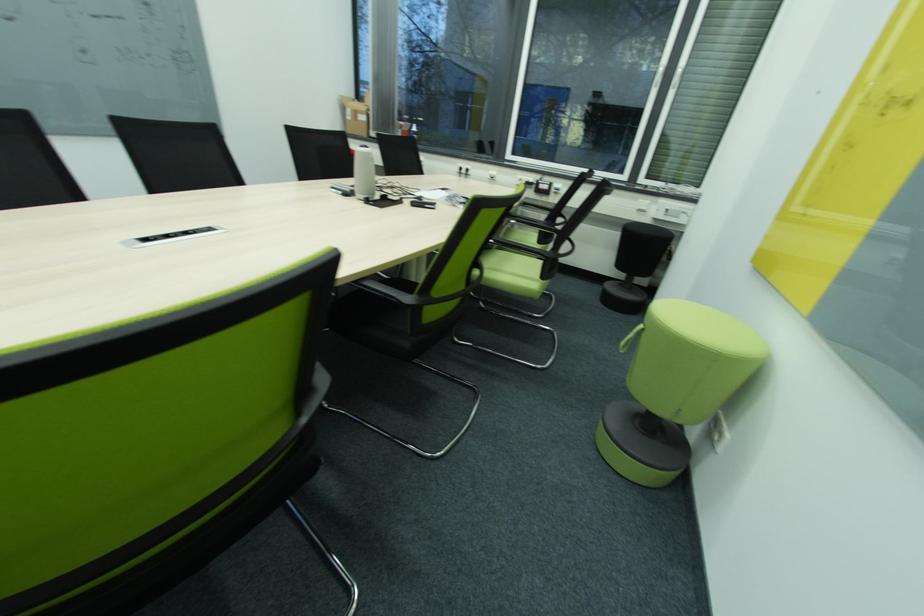
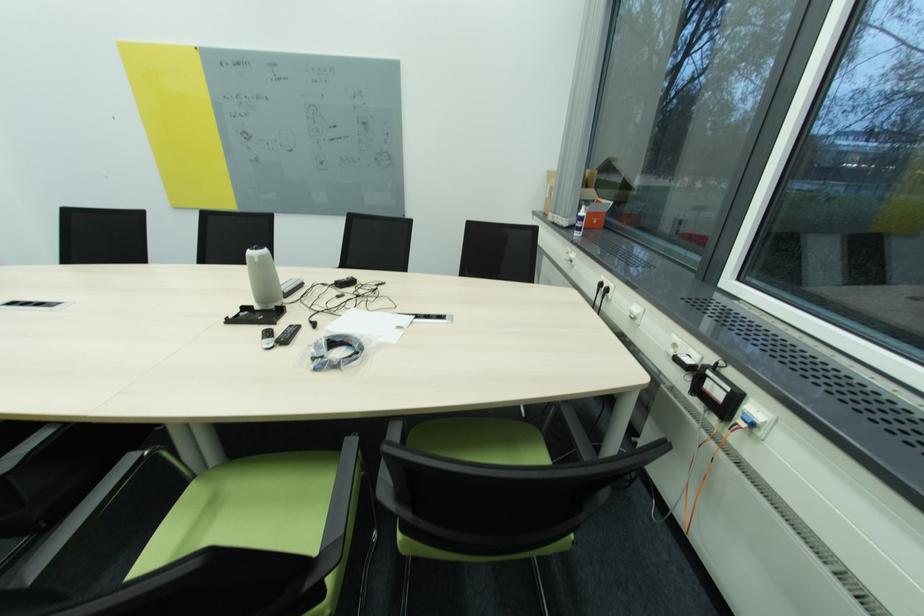
Where in the second image is the point corresponding to the point at 544,183 from the first image?

(713, 373)